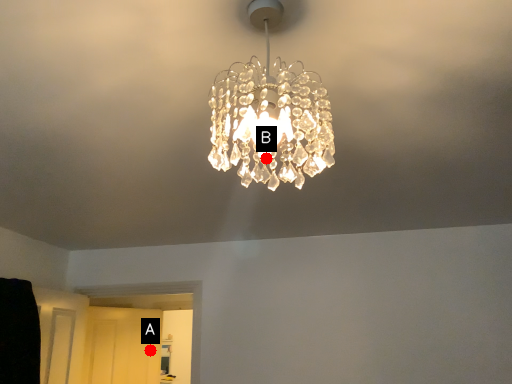
Question: Two points are circled on the image, labeled by A and B beside each circle. Which point is further to the camera?

Choices:
 (A) A is further
 (B) B is further

Answer: (A)